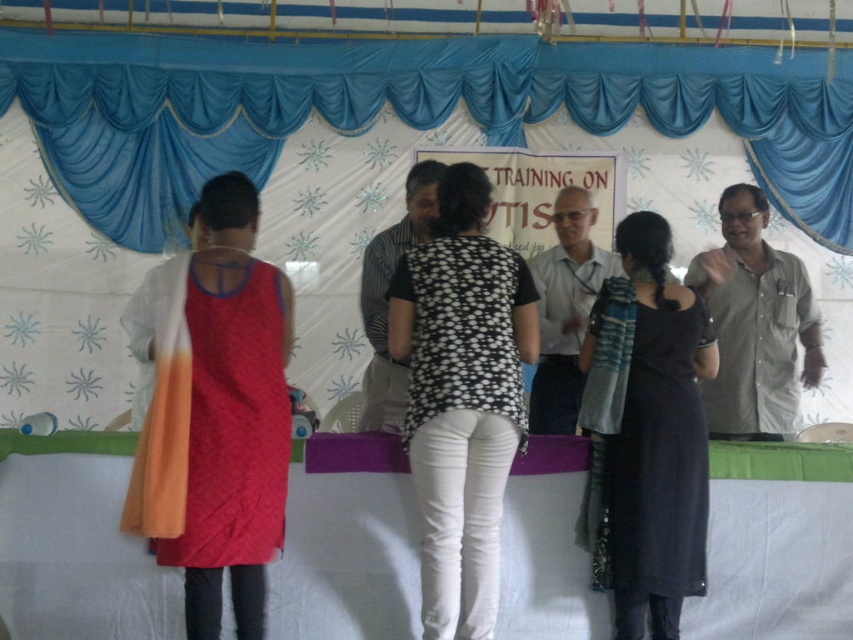
You are a photographer at the event and need to adjust the lighting. The orange fabric dress at left is currently under a spotlight. To avoid overexposing it, where should you move the spotlight relative to its current position?

The orange fabric dress at left is at point (x=213, y=412). To avoid overexposing it, move the spotlight away from the orange fabric dress at left by adjusting its position to a coordinate that is not overlapping with the dress.

You are a photographer adjusting your camera settings to capture a group photo. You notice two participants wearing black dotted shirt at center and black woolen dress at center. Which clothing item should you focus on first to ensure proper exposure, considering their height difference?

The black dotted shirt at center is taller than the black woolen dress at center, so you should focus on the black dotted shirt at center first to ensure proper exposure due to its height advantage.